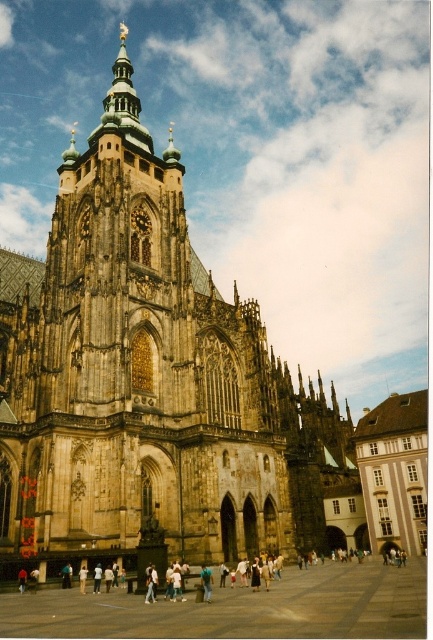
Question: From the image, what is the correct spatial relationship of brown stone church at center in relation to light blue jeans at center?

Choices:
 (A) above
 (B) below

Answer: (A)

Question: Does brown stone church at center have a smaller size compared to light blue jeans at center?

Choices:
 (A) yes
 (B) no

Answer: (B)

Question: Is the position of brown stone church at center more distant than that of light blue jeans at center?

Choices:
 (A) yes
 (B) no

Answer: (A)

Question: Among these points, which one is nearest to the camera?

Choices:
 (A) (212, 396)
 (B) (210, 593)

Answer: (B)

Question: Among these objects, which one is nearest to the camera?

Choices:
 (A) brown stone church at center
 (B) light blue jeans at center

Answer: (B)